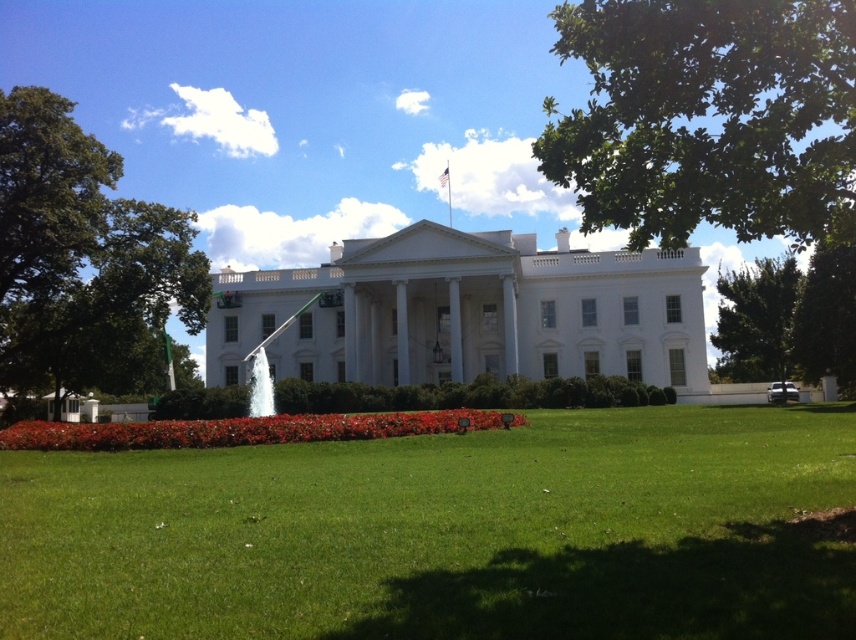
Is point (602, 52) closer to viewer compared to point (734, 321)?

Yes, point (602, 52) is closer to viewer.

Who is higher up, green leafy tree at upper right or green leafy tree at right?

green leafy tree at upper right

The width and height of the screenshot is (856, 640). What do you see at coordinates (706, 115) in the screenshot?
I see `green leafy tree at upper right` at bounding box center [706, 115].

Where is `green leafy tree at upper right`? The image size is (856, 640). green leafy tree at upper right is located at coordinates (706, 115).

Does green leafy tree at upper right lie in front of green leafy tree at left?

Yes.

Does green leafy tree at upper right have a lesser width compared to green leafy tree at left?

No.

Between point (635, 22) and point (117, 360), which one is positioned in front?

Positioned in front is point (635, 22).

Locate an element on the screen. green leafy tree at upper right is located at coordinates (706, 115).

From the picture: Who is positioned more to the right, green leafy tree at left or green leafy tree at right?

green leafy tree at right

Is green leafy tree at left closer to the viewer compared to green leafy tree at right?

Yes, it is.

Which is behind, point (27, 369) or point (794, 307)?

The point (27, 369) is more distant.

Where is `green leafy tree at left`? The height and width of the screenshot is (640, 856). green leafy tree at left is located at coordinates (x=82, y=256).